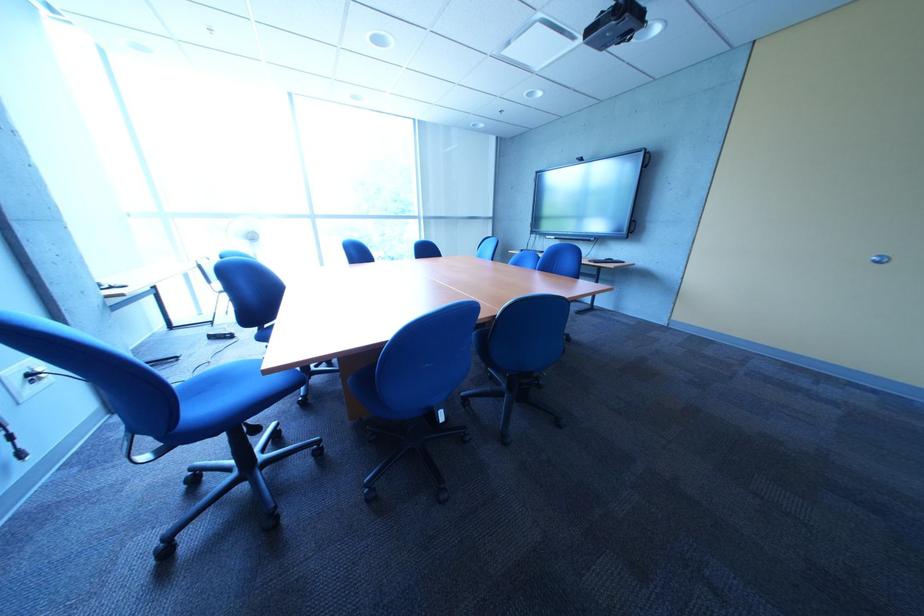
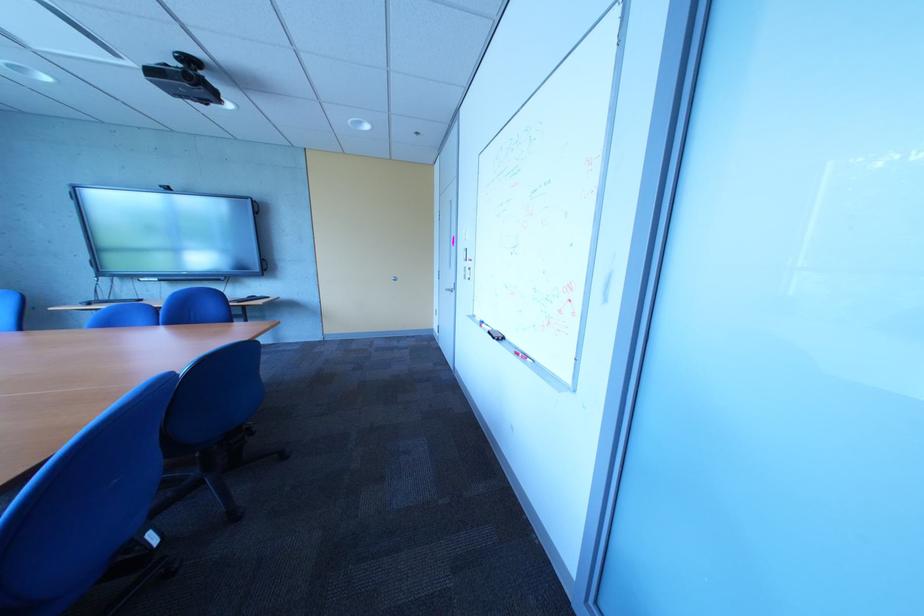
Question: Based on the continuous images, in which direction is the camera rotating? Reply with the corresponding letter.

Choices:
 (A) Left
 (B) Right
 (C) Up
 (D) Down

Answer: (B)